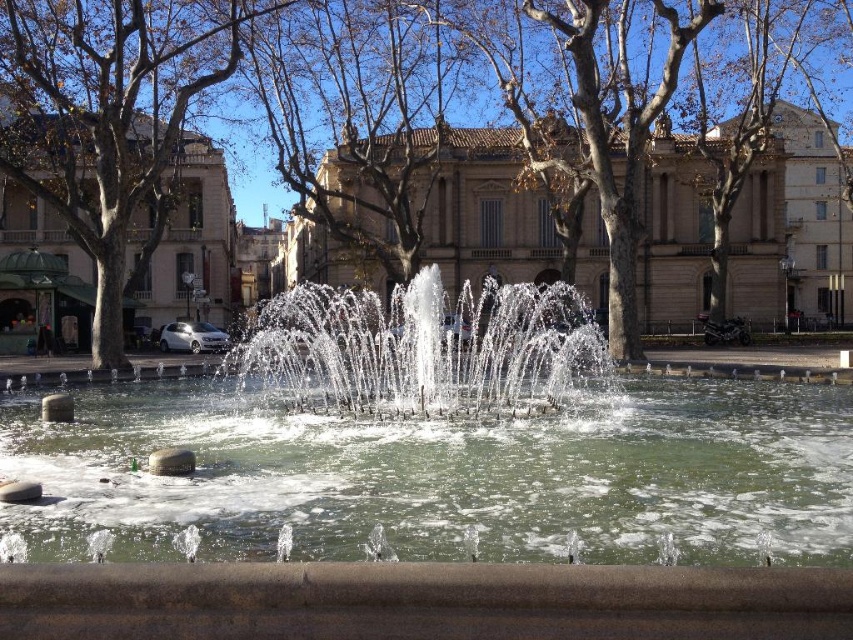
Looking at this image, who is shorter, brown leafless tree at left or clear water fountain at center?

With less height is clear water fountain at center.

Does point (73, 108) come closer to viewer compared to point (543, 401)?

That is False.

Between point (178, 113) and point (357, 416), which one is positioned in front?

Positioned in front is point (357, 416).

Locate an element on the screen. This screenshot has width=853, height=640. brown leafless tree at left is located at coordinates (108, 116).

Is brown leafless tree at center further to camera compared to clear water fountain at center?

Yes.

Is brown leafless tree at center shorter than clear water fountain at center?

No, brown leafless tree at center is not shorter than clear water fountain at center.

Is point (561, 96) closer to viewer compared to point (238, 371)?

No, (561, 96) is behind (238, 371).

Where is `brown leafless tree at center`? The height and width of the screenshot is (640, 853). brown leafless tree at center is located at coordinates (618, 116).

From the picture: Is clear water at center to the right of brown leafless tree at left from the viewer's perspective?

Yes, clear water at center is to the right of brown leafless tree at left.

Is clear water at center behind brown leafless tree at left?

No.

Where is `clear water at center`? Image resolution: width=853 pixels, height=640 pixels. clear water at center is located at coordinates (444, 476).